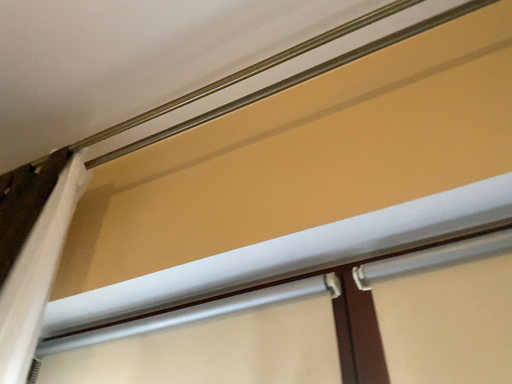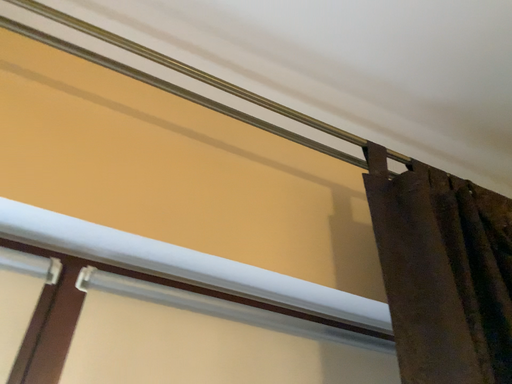
Question: Which way did the camera rotate in the video?

Choices:
 (A) rotated downward
 (B) rotated upward

Answer: (A)